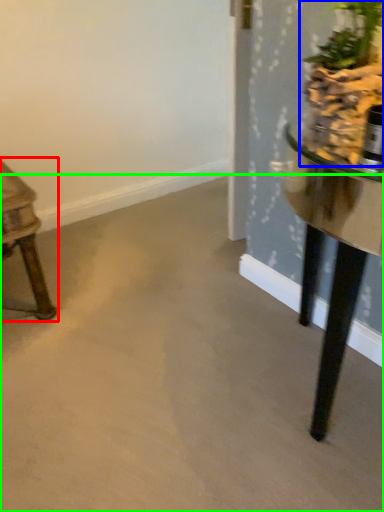
Question: Based on their relative distances, which object is farther from table (highlighted by a red box)? Choose from houseplant (highlighted by a blue box) and concrete (highlighted by a green box).

Choices:
 (A) houseplant
 (B) concrete

Answer: (A)